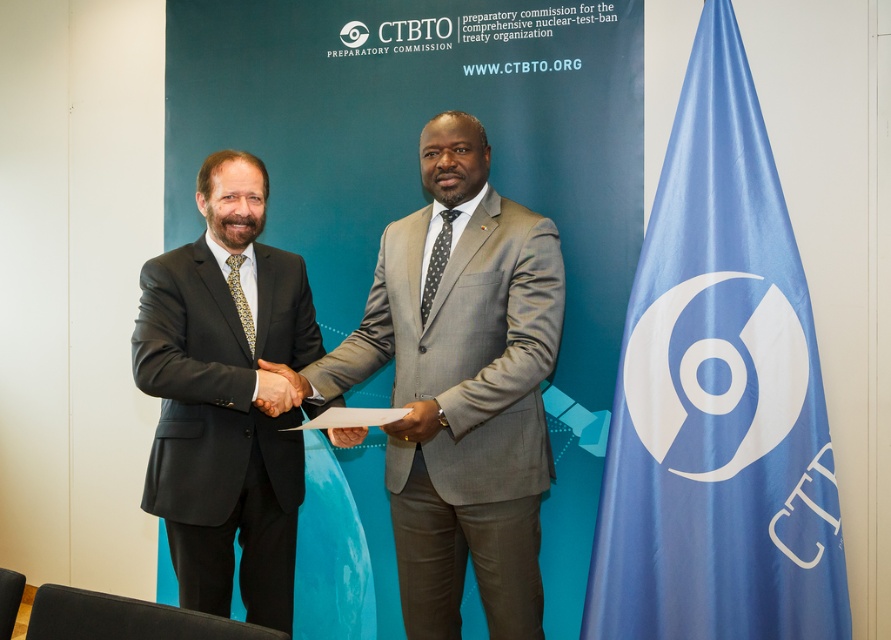
Who is more forward, (771,320) or (444,444)?

Point (444,444) is in front.

Is blue fabric flag at right above gray wool suit at center?

Yes, blue fabric flag at right is above gray wool suit at center.

In order to click on blue fabric flag at right in this screenshot , I will do `click(718, 396)`.

Who is shorter, blue fabric flag at right or smooth skin hand at center?

smooth skin hand at center is shorter.

Can you confirm if blue fabric flag at right is wider than smooth skin hand at center?

Correct, the width of blue fabric flag at right exceeds that of smooth skin hand at center.

What do you see at coordinates (718, 396) in the screenshot?
I see `blue fabric flag at right` at bounding box center [718, 396].

The height and width of the screenshot is (640, 891). I want to click on blue fabric flag at right, so click(x=718, y=396).

Who is positioned more to the right, black leather hand at center or smooth skin hand at center?

From the viewer's perspective, smooth skin hand at center appears more on the right side.

Which is below, black leather hand at center or smooth skin hand at center?

Positioned lower is smooth skin hand at center.

Is point (276, 394) positioned in front of point (334, 444)?

Yes, point (276, 394) is in front of point (334, 444).

I want to click on black leather hand at center, so click(x=278, y=388).